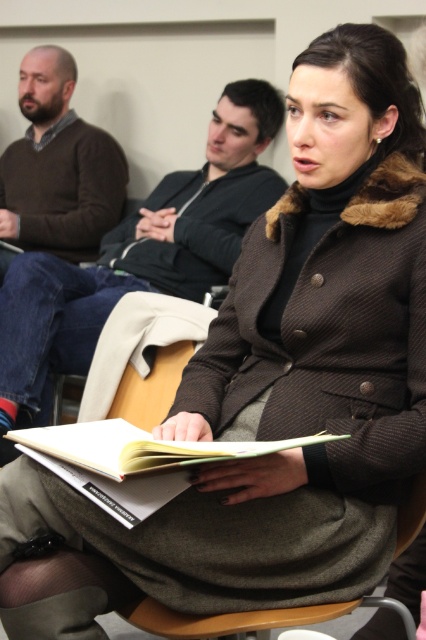
Question: Which point appears farthest from the camera in this image?

Choices:
 (A) (146, 512)
 (B) (29, 260)

Answer: (B)

Question: Observing the image, what is the correct spatial positioning of matte brown sweater at left in reference to white paper book at center?

Choices:
 (A) above
 (B) below

Answer: (A)

Question: Is brown sweater at center above matte brown sweater at left?

Choices:
 (A) no
 (B) yes

Answer: (A)

Question: Which object appears closest to the camera in this image?

Choices:
 (A) brown sweater at center
 (B) white paper book at center

Answer: (B)

Question: Does brown sweater at center have a greater width compared to matte brown sweater at left?

Choices:
 (A) yes
 (B) no

Answer: (A)

Question: Based on their relative distances, which object is farther from the brown sweater at center?

Choices:
 (A) white paper book at center
 (B) matte brown sweater at left

Answer: (A)